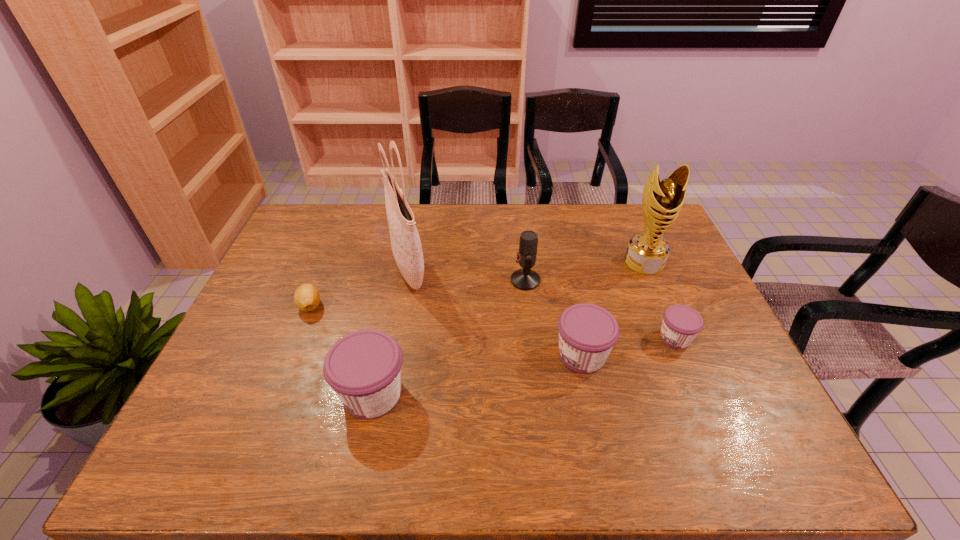
This screenshot has height=540, width=960. I want to click on free space located 0.140m at the stem end of the shortest object, so click(289, 357).

Where is `free space located on the front-facing side of the sixth shortest object`? free space located on the front-facing side of the sixth shortest object is located at coordinates (675, 333).

What are the coordinates of `vacant space located on the side of the fourth object from right to left with the red ring` in the screenshot? It's located at (417, 280).

Where is `blank area located 0.320m on the side of the fourth object from right to left with the red ring`? blank area located 0.320m on the side of the fourth object from right to left with the red ring is located at coordinates (407, 280).

Where is `vacant space situated 0.130m on the side of the fourth object from right to left with the red ring`? vacant space situated 0.130m on the side of the fourth object from right to left with the red ring is located at coordinates (468, 280).

Where is `vacant region located on the left of the shopping bag`? The width and height of the screenshot is (960, 540). vacant region located on the left of the shopping bag is located at coordinates (345, 269).

You are a GUI agent. You are given a task and a screenshot of the screen. Output one action in this format:
    pyautogui.click(x=<x>, y=<y>)
    Task: Click on the object that is at the far edge
    
    Given the screenshot: What is the action you would take?
    pyautogui.click(x=406, y=246)

I want to click on object located at the near edge, so click(x=363, y=367).

In order to click on object located at the left edge in this screenshot , I will do `click(306, 297)`.

Image resolution: width=960 pixels, height=540 pixels. I want to click on jam located at the right edge, so click(x=681, y=324).